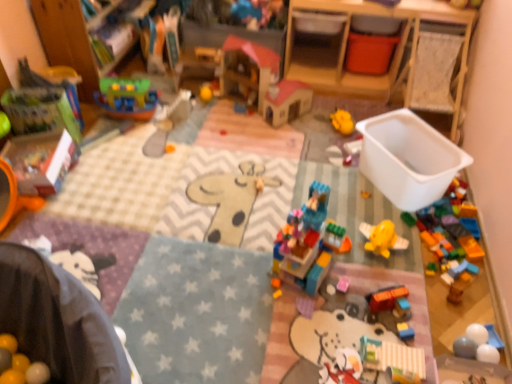
The image size is (512, 384). Find the location of `free area in between wooden dollhouse at center, marked as the 2th toy in a top-to-bottom arrangement, and translucent plastic castle at center, marked as the third toy in a bottom-to-top arrangement`. free area in between wooden dollhouse at center, marked as the 2th toy in a top-to-bottom arrangement, and translucent plastic castle at center, marked as the third toy in a bottom-to-top arrangement is located at coordinates (271, 163).